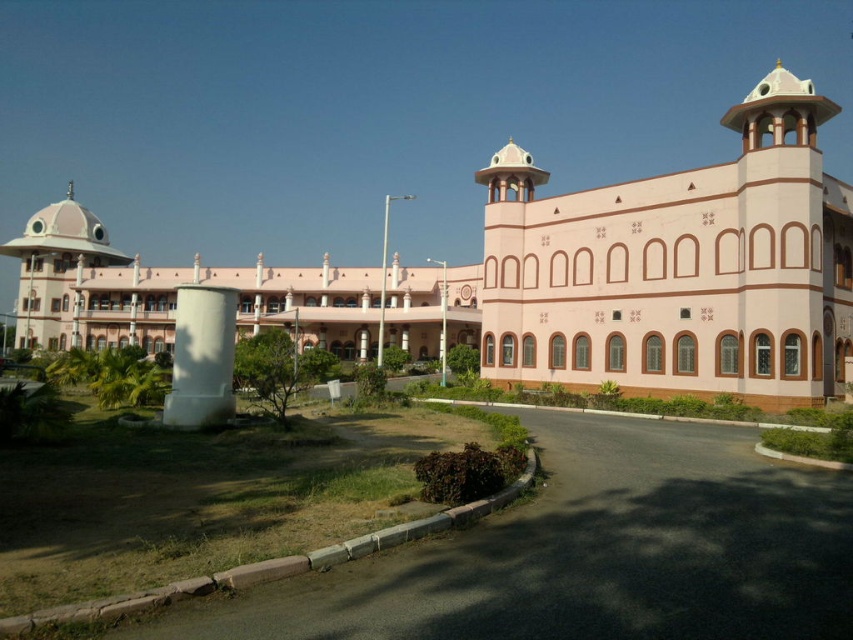
Question: In this image, where is pink stucco building at center located relative to pink stone building at center?

Choices:
 (A) above
 (B) below

Answer: (A)

Question: Which object is positioned closest to the pink stucco building at center?

Choices:
 (A) white smooth pillar at center
 (B) pink stone building at center

Answer: (B)

Question: Which is nearer to the white smooth pillar at center?

Choices:
 (A) pink stone building at center
 (B) pink stucco building at center

Answer: (B)

Question: Does pink stucco building at center lie behind white smooth pillar at center?

Choices:
 (A) yes
 (B) no

Answer: (A)

Question: Does pink stucco building at center lie in front of white smooth pillar at center?

Choices:
 (A) no
 (B) yes

Answer: (A)

Question: Which object appears closest to the camera in this image?

Choices:
 (A) pink stone building at center
 (B) white smooth pillar at center
 (C) pink stucco building at center

Answer: (B)